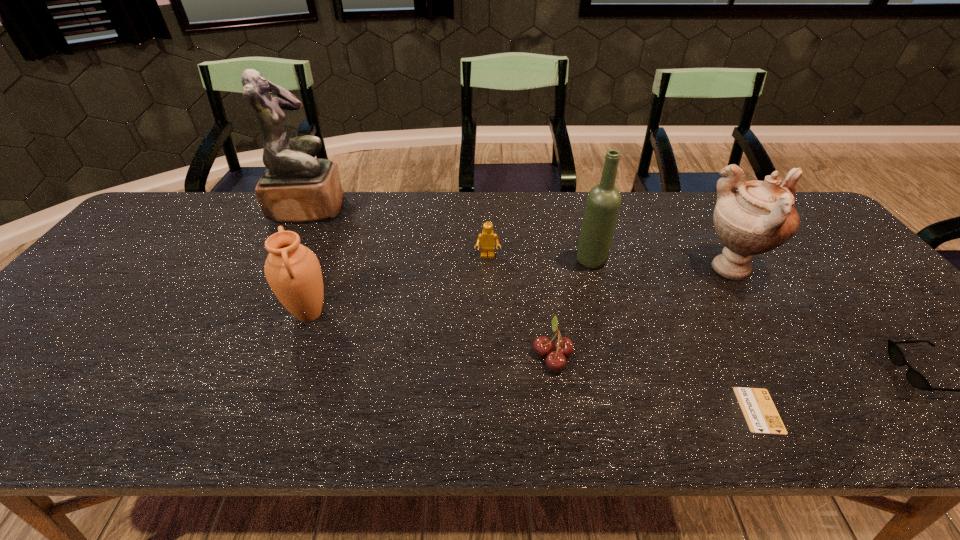
Find the location of a particular element. This screenshot has height=540, width=960. object present at the far edge is located at coordinates (296, 187).

Where is `object that is positioned at the near edge`? The height and width of the screenshot is (540, 960). object that is positioned at the near edge is located at coordinates (761, 415).

Locate an element on the screen. free region at the far edge of the desktop is located at coordinates (476, 199).

This screenshot has height=540, width=960. In order to click on blank space at the near edge in this screenshot , I will do `click(276, 420)`.

Image resolution: width=960 pixels, height=540 pixels. In the image, there is a desktop. What are the coordinates of `vacant space at the left edge` in the screenshot? It's located at (93, 345).

You are a GUI agent. You are given a task and a screenshot of the screen. Output one action in this format:
    pyautogui.click(x=<x>, y=<y>)
    Task: Click on the vacant region at the right edge
    This screenshot has height=540, width=960.
    Given the screenshot: What is the action you would take?
    pyautogui.click(x=880, y=360)

In the image, there is a desktop. Where is `vacant region at the far left corner`? The image size is (960, 540). vacant region at the far left corner is located at coordinates (186, 197).

In order to click on free space between the third object from left to right and the fourth object from left to right in this screenshot , I will do `click(520, 305)`.

Find the location of a particular element. free point between the left urn and the identity card is located at coordinates (534, 362).

Where is `free point between the fourth shortest object and the taller urn`? The width and height of the screenshot is (960, 540). free point between the fourth shortest object and the taller urn is located at coordinates (610, 263).